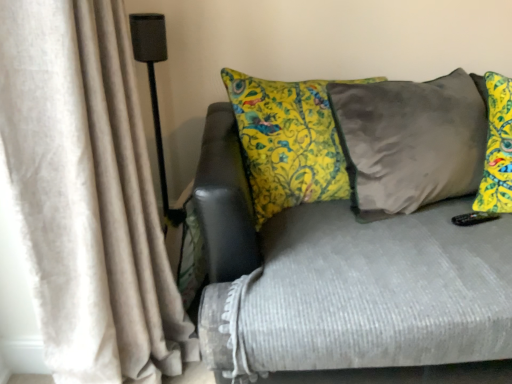
At what (x,y) coordinates should I click in order to perform the action: click on black matte speaker at left. Please return your answer as a coordinate pair (x, y). The width and height of the screenshot is (512, 384). Looking at the image, I should click on (152, 73).

Identify the location of beige velvet curtain at left. Image resolution: width=512 pixels, height=384 pixels. (87, 194).

Find the location of a particular element. black matte speaker at left is located at coordinates (152, 73).

In the scene shown: Between beige velvet curtain at left and black matte speaker at left, which one appears on the left side from the viewer's perspective?

black matte speaker at left.

Between point (132, 188) and point (152, 24), which one is positioned in front?

The point (132, 188) is more forward.

How much distance is there between beige velvet curtain at left and black matte speaker at left?

A distance of 31.39 inches exists between beige velvet curtain at left and black matte speaker at left.

From the image's perspective, which is below, beige velvet curtain at left or black matte speaker at left?

beige velvet curtain at left.

From the image's perspective, relative to textured gray couch at center, is beige velvet curtain at left above or below?

Clearly, from the image's perspective, beige velvet curtain at left is above textured gray couch at center.

From a real-world perspective, is beige velvet curtain at left over textured gray couch at center?

Indeed, from a real-world perspective, beige velvet curtain at left stands above textured gray couch at center.

Can you tell me how much beige velvet curtain at left and textured gray couch at center differ in facing direction?

The angle between the facing direction of beige velvet curtain at left and the facing direction of textured gray couch at center is 86.7 degrees.

From the picture: Is beige velvet curtain at left placed right next to textured gray couch at center?

beige velvet curtain at left and textured gray couch at center are not in contact.

I want to click on studio couch that appears in front of the black matte speaker at left, so click(x=345, y=279).

How many degrees apart are the facing directions of black matte speaker at left and textured gray couch at center?

0.649 degrees separate the facing orientations of black matte speaker at left and textured gray couch at center.

Is black matte speaker at left oriented towards textured gray couch at center?

No, black matte speaker at left does not turn towards textured gray couch at center.

Considering the relative sizes of black matte speaker at left and textured gray couch at center in the image provided, is black matte speaker at left taller than textured gray couch at center?

Correct, black matte speaker at left is much taller as textured gray couch at center.

Could you tell me if textured gray couch at center is turned towards beige velvet curtain at left?

No.

Is textured gray couch at center in contact with beige velvet curtain at left?

There is a gap between textured gray couch at center and beige velvet curtain at left.

Identify the location of studio couch on the right side of beige velvet curtain at left. (345, 279).

From their relative heights in the image, would you say textured gray couch at center is taller or shorter than beige velvet curtain at left?

In the image, textured gray couch at center appears to be shorter than beige velvet curtain at left.

Where is `curtain on the right of black matte speaker at left`? curtain on the right of black matte speaker at left is located at coordinates (87, 194).

Is beige velvet curtain at left located within black matte speaker at left?

Actually, beige velvet curtain at left is outside black matte speaker at left.

Who is bigger, black matte speaker at left or beige velvet curtain at left?

beige velvet curtain at left is bigger.

Measure the distance from black matte speaker at left to beige velvet curtain at left.

black matte speaker at left and beige velvet curtain at left are 31.39 inches apart from each other.

Can you confirm if textured gray couch at center is taller than black matte speaker at left?

No.

What's the angular difference between textured gray couch at center and black matte speaker at left's facing directions?

0.649 degrees separate the facing orientations of textured gray couch at center and black matte speaker at left.

In terms of width, does textured gray couch at center look wider or thinner when compared to black matte speaker at left?

textured gray couch at center is wider than black matte speaker at left.

Which is nearer, (367, 374) or (156, 60)?

Point (367, 374) is positioned closer to the camera compared to point (156, 60).

The image size is (512, 384). I want to click on curtain below the black matte speaker at left (from a real-world perspective), so click(x=87, y=194).

Image resolution: width=512 pixels, height=384 pixels. Identify the location of curtain in front of the textured gray couch at center. (87, 194).

Looking at the image, which one is located closer to beige velvet curtain at left, textured gray couch at center or black matte speaker at left?

textured gray couch at center.

When comparing their distances from textured gray couch at center, does beige velvet curtain at left or black matte speaker at left seem further?

black matte speaker at left is further to textured gray couch at center.

Based on their spatial positions, is beige velvet curtain at left or textured gray couch at center further from black matte speaker at left?

textured gray couch at center lies further to black matte speaker at left than the other object.

Looking at the image, which one is located closer to black matte speaker at left, textured gray couch at center or beige velvet curtain at left?

beige velvet curtain at left.

Based on their spatial positions, is black matte speaker at left or textured gray couch at center further from beige velvet curtain at left?

The object further to beige velvet curtain at left is black matte speaker at left.

Considering their positions, is black matte speaker at left positioned closer to textured gray couch at center than beige velvet curtain at left?

Based on the image, beige velvet curtain at left appears to be nearer to textured gray couch at center.

Image resolution: width=512 pixels, height=384 pixels. What are the coordinates of `curtain between black matte speaker at left and textured gray couch at center in the horizontal direction` in the screenshot? It's located at (87, 194).